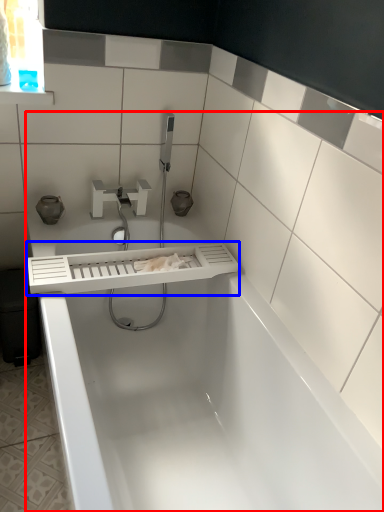
Question: Among these objects, which one is nearest to the camera, bathtub (highlighted by a red box) or balustrade (highlighted by a blue box)?

Choices:
 (A) bathtub
 (B) balustrade

Answer: (A)